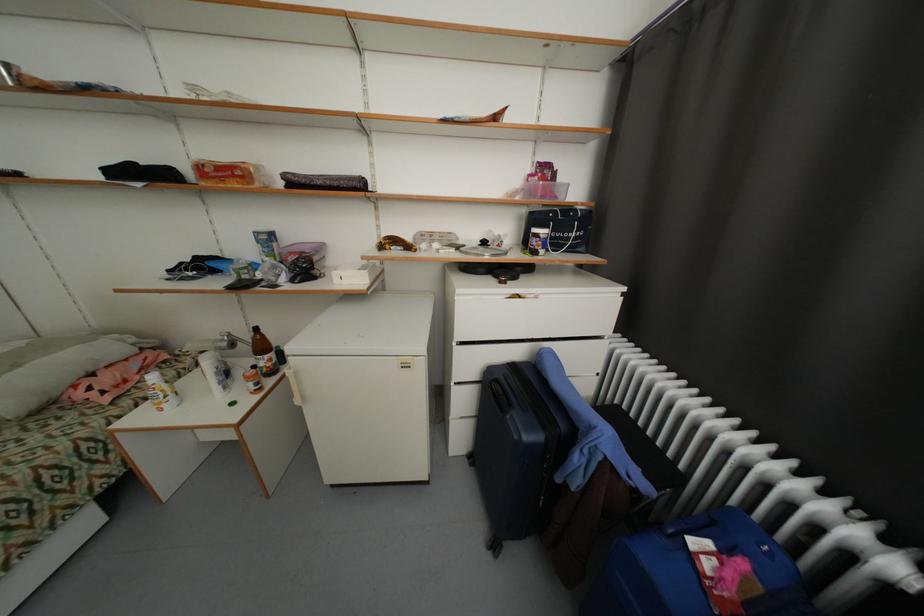
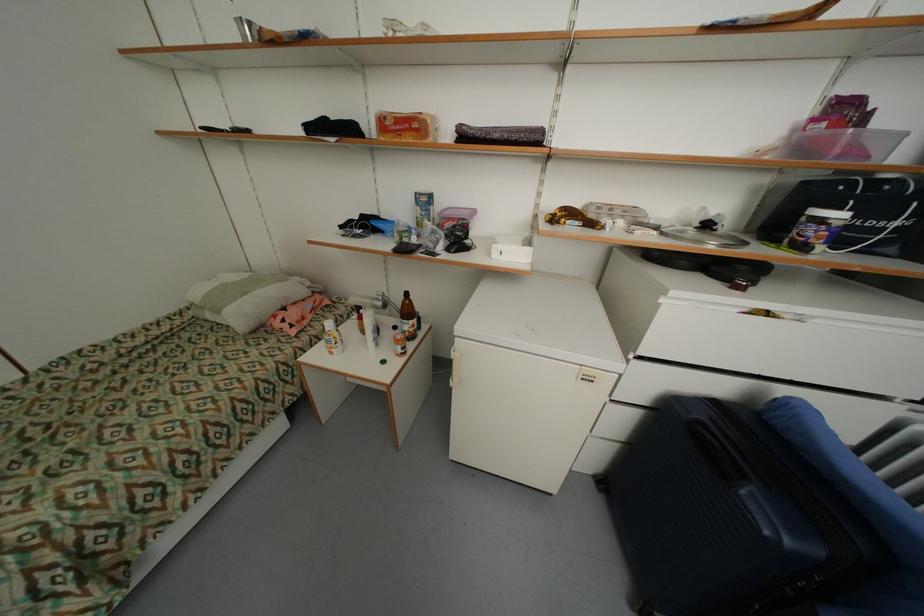
Where in the second image is the point corresponding to (x=472, y=461) from the first image?

(599, 483)